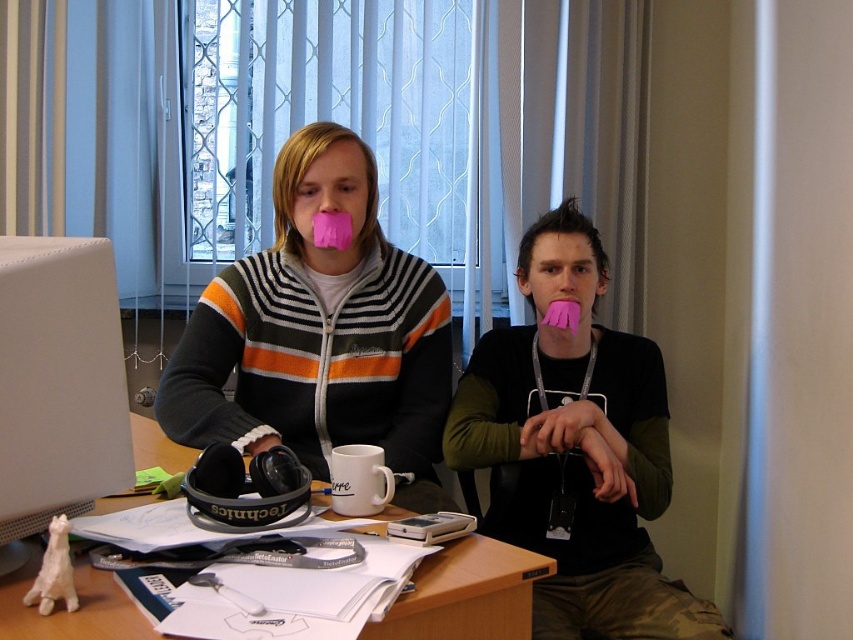
You need to place a large document on the surface of the white matte desktop computer at left and the wooden desk at center. Which surface can accommodate the document without it hanging off the edges?

The wooden desk at center can accommodate the document without it hanging off the edges since it is larger than the white matte desktop computer at left.